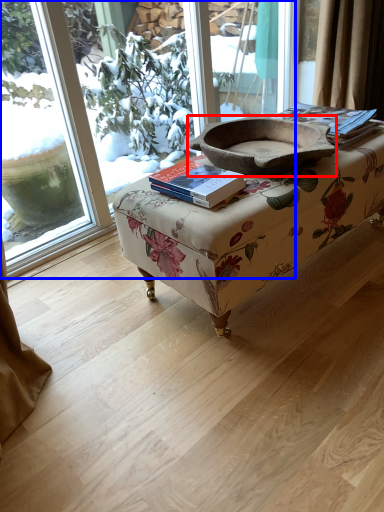
Question: Which object appears closest to the camera in this image, footrest (highlighted by a red box) or window (highlighted by a blue box)?

Choices:
 (A) footrest
 (B) window

Answer: (A)